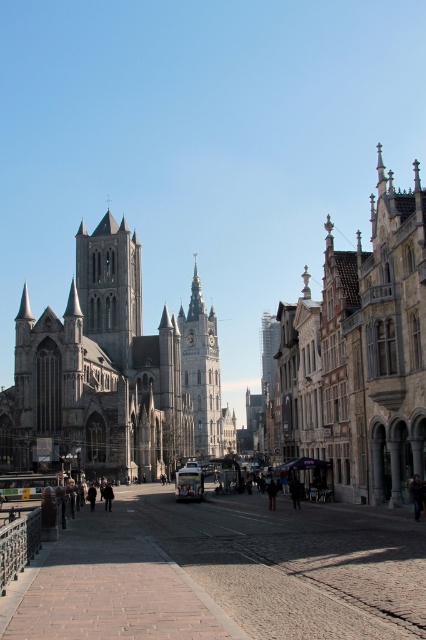
Does gray stone tower at center appear on the right side of smooth gray stone tower at center?

No, gray stone tower at center is not to the right of smooth gray stone tower at center.

Who is more distant from viewer, (134, 284) or (270, 320)?

Point (270, 320)

Find the location of a particular element. gray stone tower at center is located at coordinates (109, 285).

Which is in front, point (267, 364) or point (294, 502)?

Point (294, 502) is in front.

Does smooth gray stone tower at center appear under black wool coat at center?

No, smooth gray stone tower at center is not below black wool coat at center.

Where is `smooth gray stone tower at center`? smooth gray stone tower at center is located at coordinates [x=268, y=353].

In order to click on smooth gray stone tower at center in this screenshot , I will do `click(268, 353)`.

Who is more distant from viewer, (337, 320) or (296, 492)?

The point (296, 492) is more distant.

Between stone gothic church at right and black wool coat at center, which one appears on the right side from the viewer's perspective?

stone gothic church at right

The image size is (426, 640). Identify the location of stone gothic church at right. (360, 355).